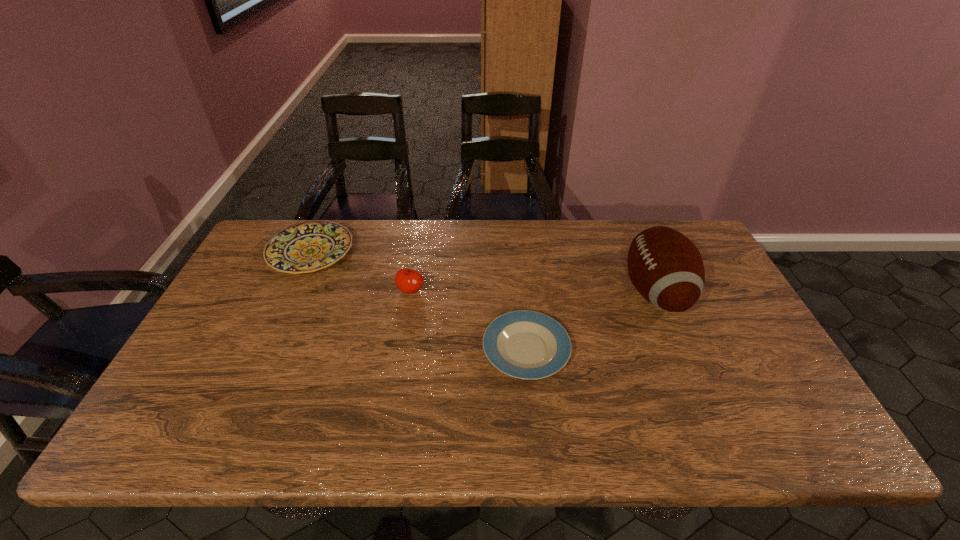
Where is `unoccupied position between the farther plate and the right plate`? This screenshot has height=540, width=960. unoccupied position between the farther plate and the right plate is located at coordinates (419, 301).

You are a GUI agent. You are given a task and a screenshot of the screen. Output one action in this format:
    pyautogui.click(x=<x>, y=<y>)
    Task: Click on the unoccupied position between the second tallest object and the nearer plate
    Image resolution: width=960 pixels, height=540 pixels.
    Given the screenshot: What is the action you would take?
    pyautogui.click(x=468, y=320)

Where is `empty location between the tallest object and the apple`? The image size is (960, 540). empty location between the tallest object and the apple is located at coordinates (533, 291).

Find the location of a particular element. The height and width of the screenshot is (540, 960). free space between the farther plate and the football is located at coordinates (483, 272).

Identify the location of free space between the farther plate and the apple. The height and width of the screenshot is (540, 960). (361, 271).

Where is `object that ranks as the third closest to the second tallest object`? Image resolution: width=960 pixels, height=540 pixels. object that ranks as the third closest to the second tallest object is located at coordinates (666, 268).

Identify which object is the second closest to the football. Please provide its 2D coordinates. Your answer should be formatted as a tuple, i.e. [(x, y)], where the tuple contains the x and y coordinates of a point satisfying the conditions above.

[(409, 281)]

This screenshot has height=540, width=960. Find the location of `free space that satisfies the following two spatial constraints: 1. on the front side of the farther plate; 2. on the left side of the second object from right to left`. free space that satisfies the following two spatial constraints: 1. on the front side of the farther plate; 2. on the left side of the second object from right to left is located at coordinates (267, 349).

What are the coordinates of `vacant area that satisfies the following two spatial constraints: 1. on the front side of the second object from left to right; 2. on the left side of the leftmost object` in the screenshot? It's located at (294, 290).

What are the coordinates of `free spot that satisfies the following two spatial constraints: 1. on the front side of the third shortest object; 2. on the right side of the left plate` in the screenshot? It's located at (294, 290).